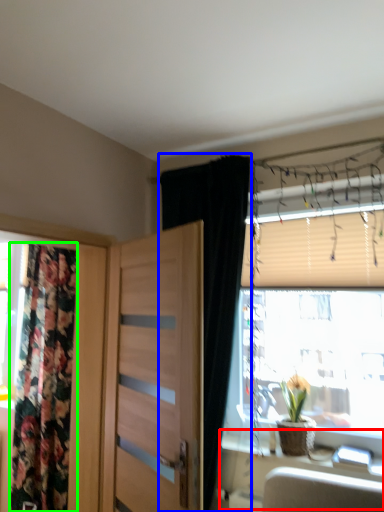
Question: Which object is positioned farthest from table (highlighted by a red box)? Select from curtain (highlighted by a blue box) and curtain (highlighted by a green box).

Choices:
 (A) curtain
 (B) curtain

Answer: (B)